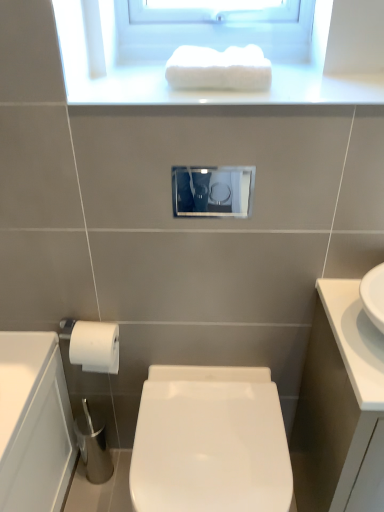
At what (x,y) coordinates should I click in order to perform the action: click on vacant space in front of white fluffy towel at upper center. Please return your answer as a coordinate pair (x, y). The width and height of the screenshot is (384, 512). Looking at the image, I should click on (217, 98).